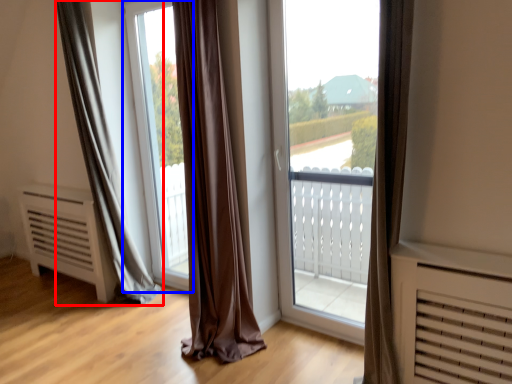
Question: Which object is closer to the camera taking this photo, curtain (highlighted by a red box) or window screen (highlighted by a blue box)?

Choices:
 (A) curtain
 (B) window screen

Answer: (A)